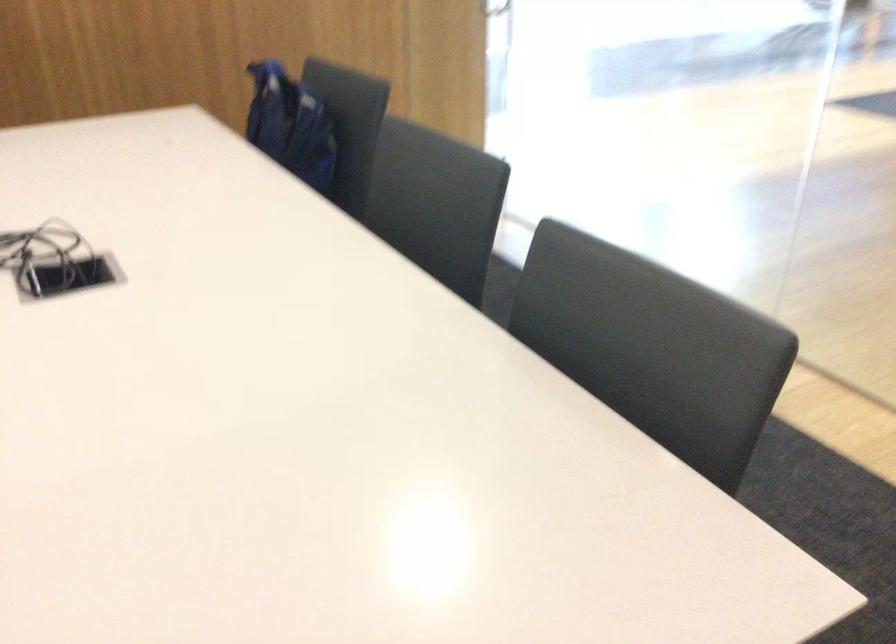
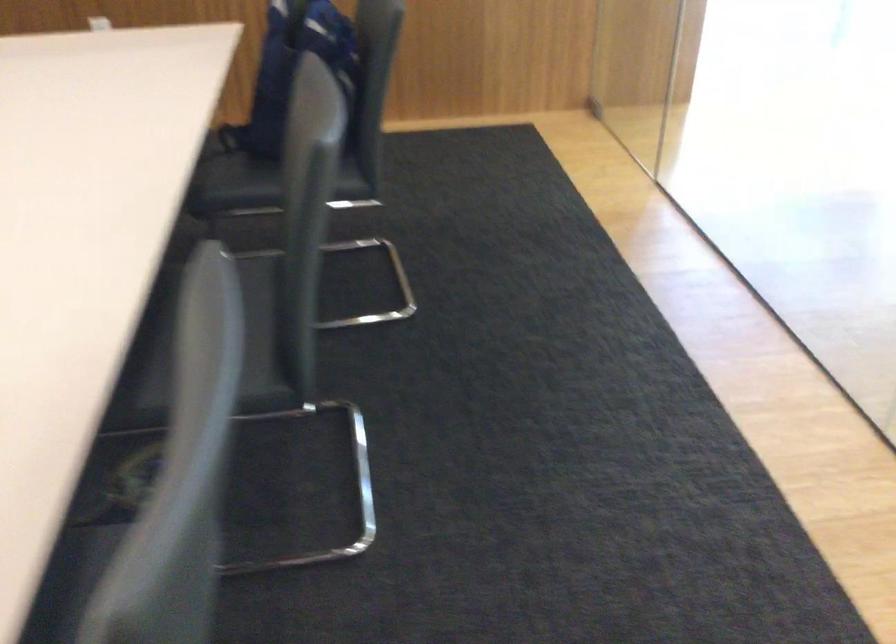
Question: The camera is either moving clockwise (left) or counter-clockwise (right) around the object. The first image is from the beginning of the video and the second image is from the end. Is the camera moving left or right when shooting the video?

Choices:
 (A) Left
 (B) Right

Answer: (B)